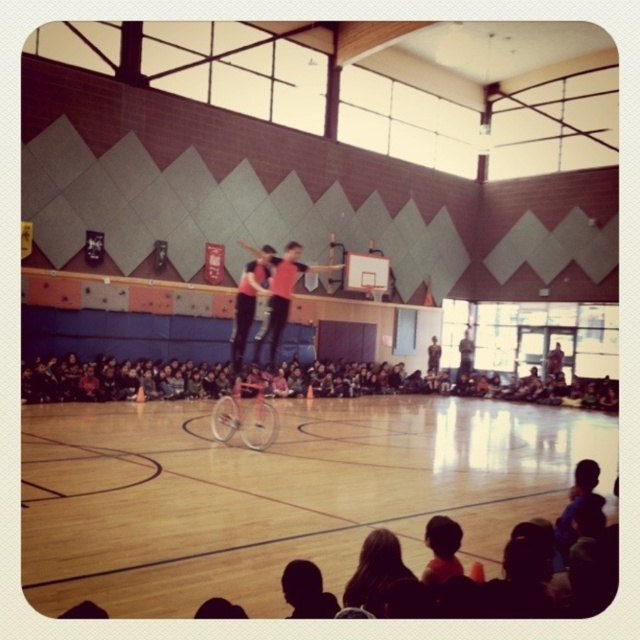
Does pink matte bicycle at center have a greater height compared to matte pink bicycle at center?

Incorrect, pink matte bicycle at center's height is not larger of matte pink bicycle at center's.

Who is more forward, (x=218, y=420) or (x=285, y=310)?

Positioned in front is point (x=285, y=310).

Where is `pink matte bicycle at center`? pink matte bicycle at center is located at coordinates (244, 416).

Is wooden basketball court at center further to camera compared to matte pink bicycle at center?

No.

Who is higher up, wooden basketball court at center or matte pink bicycle at center?

matte pink bicycle at center is above.

Which is behind, point (600, 451) or point (253, 348)?

The point (253, 348) is more distant.

Find the location of `wooden basketball court at center`. wooden basketball court at center is located at coordinates (276, 492).

Which is in front, point (195, 467) or point (241, 406)?

Point (195, 467) is more forward.

Which of these two, wooden basketball court at center or pink matte bicycle at center, stands shorter?

pink matte bicycle at center is shorter.

Which is behind, point (413, 456) or point (211, 429)?

The point (211, 429) is behind.

Locate an element on the screen. The image size is (640, 640). wooden basketball court at center is located at coordinates (276, 492).